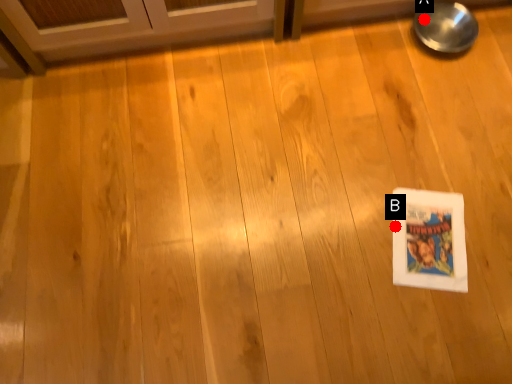
Question: Two points are circled on the image, labeled by A and B beside each circle. Which point is farther to the camera?

Choices:
 (A) A is further
 (B) B is further

Answer: (A)